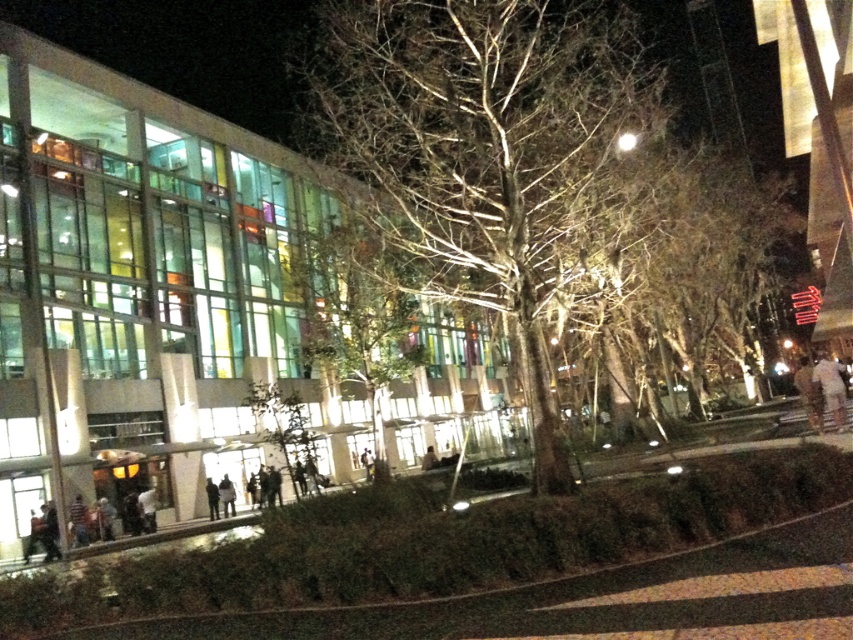
Based on the photo, is bare branches at center to the right of dark gray fabric jacket at lower left from the viewer's perspective?

Indeed, bare branches at center is positioned on the right side of dark gray fabric jacket at lower left.

Who is positioned more to the right, bare branches at center or dark gray fabric jacket at lower left?

From the viewer's perspective, bare branches at center appears more on the right side.

What do you see at coordinates (480, 145) in the screenshot? I see `bare branches at center` at bounding box center [480, 145].

The height and width of the screenshot is (640, 853). Identify the location of bare branches at center. 480,145.

How distant is dark gray jacket at lower center from dark gray fabric jacket at lower left?

The distance of dark gray jacket at lower center from dark gray fabric jacket at lower left is 25.30 inches.

The image size is (853, 640). I want to click on dark gray jacket at lower center, so click(x=225, y=497).

Who is more forward, (219, 497) or (212, 484)?

Point (219, 497)

The image size is (853, 640). Identify the location of dark gray jacket at lower center. (225, 497).

Is bare branches at center to the left of dark gray jacket at lower center from the viewer's perspective?

Incorrect, bare branches at center is not on the left side of dark gray jacket at lower center.

Is bare branches at center shorter than dark gray jacket at lower center?

No.

Which is in front, point (469, 13) or point (227, 500)?

Point (469, 13) is more forward.

Find the location of a particular element. The image size is (853, 640). bare branches at center is located at coordinates (480, 145).